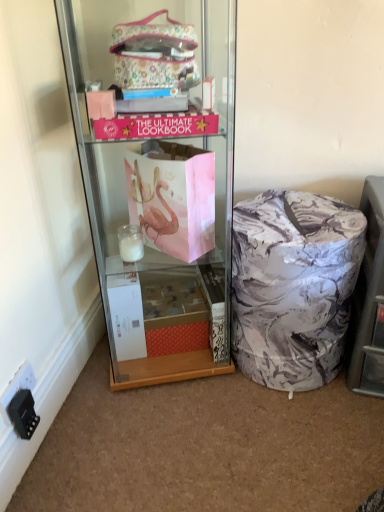
Identify the location of vacant region in front of marble-patterned laundry basket at lower right. The image size is (384, 512). (287, 438).